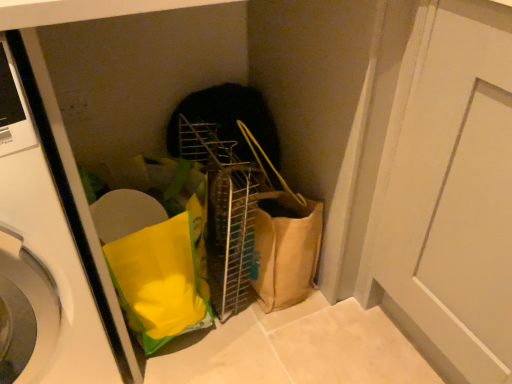
The height and width of the screenshot is (384, 512). What do you see at coordinates (42, 248) in the screenshot? I see `white glossy washing machine at left` at bounding box center [42, 248].

Locate an element on the screen. white glossy washing machine at left is located at coordinates (42, 248).

This screenshot has height=384, width=512. What do you see at coordinates (453, 198) in the screenshot?
I see `white matte door at center-right` at bounding box center [453, 198].

Identify the location of white matte door at center-right. The image size is (512, 384). pos(453,198).

Identify the location of white glossy washing machine at left. (42, 248).

Which object is positioned more to the left, white matte door at center-right or white glossy washing machine at left?

white glossy washing machine at left is more to the left.

Does white matte door at center-right come behind white glossy washing machine at left?

Yes.

Is point (484, 38) behind point (15, 82)?

Yes, it is.

From the image's perspective, would you say white matte door at center-right is shown under white glossy washing machine at left?

Yes.

From a real-world perspective, which is physically above, white matte door at center-right or white glossy washing machine at left?

In real-world perspective, white glossy washing machine at left is above.

Does white matte door at center-right have a lesser width compared to white glossy washing machine at left?

Indeed, white matte door at center-right has a lesser width compared to white glossy washing machine at left.

Between white matte door at center-right and white glossy washing machine at left, which one has less height?

With less height is white matte door at center-right.

Between white matte door at center-right and white glossy washing machine at left, which one has larger size?

Bigger between the two is white glossy washing machine at left.

Does white matte door at center-right contain white glossy washing machine at left?

Actually, white glossy washing machine at left is outside white matte door at center-right.

Is white matte door at center-right not near white glossy washing machine at left?

white matte door at center-right is actually quite close to white glossy washing machine at left.

Is white glossy washing machine at left at the back of white matte door at center-right?

No, white matte door at center-right's orientation is not away from white glossy washing machine at left.

From the picture: How distant is white matte door at center-right from white glossy washing machine at left?

white matte door at center-right and white glossy washing machine at left are 27.28 inches apart from each other.

You are a GUI agent. You are given a task and a screenshot of the screen. Output one action in this format:
    pyautogui.click(x=<x>, y=<y>)
    Task: Click on the door behind the white glossy washing machine at left
    The image size is (512, 384).
    Given the screenshot: What is the action you would take?
    pyautogui.click(x=453, y=198)

In the image, is white glossy washing machine at left on the left side or the right side of white matte door at center-right?

Based on their positions, white glossy washing machine at left is located to the left of white matte door at center-right.

Between white glossy washing machine at left and white matte door at center-right, which one is positioned behind?

white matte door at center-right is more distant.

Which is farther from the camera, (53, 294) or (389, 254)?

Point (389, 254)

From the image's perspective, does white glossy washing machine at left appear higher than white matte door at center-right?

Indeed, from the image's perspective, white glossy washing machine at left is shown above white matte door at center-right.

From a real-world perspective, which is physically below, white glossy washing machine at left or white matte door at center-right?

white matte door at center-right is physically lower.

Considering the sizes of objects white glossy washing machine at left and white matte door at center-right in the image provided, who is thinner, white glossy washing machine at left or white matte door at center-right?

white matte door at center-right is thinner.

Is white glossy washing machine at left taller than white matte door at center-right?

Yes, white glossy washing machine at left is taller than white matte door at center-right.

Between white glossy washing machine at left and white matte door at center-right, which one has smaller size?

white matte door at center-right.

Do you think white glossy washing machine at left is within white matte door at center-right, or outside of it?

white glossy washing machine at left is outside white matte door at center-right.

Are white glossy washing machine at left and white matte door at center-right far apart?

No, white glossy washing machine at left is not far away from white matte door at center-right.

Does white glossy washing machine at left turn towards white matte door at center-right?

No, white glossy washing machine at left is not oriented towards white matte door at center-right.

This screenshot has height=384, width=512. Identify the location of door that is on the right side of white glossy washing machine at left. (453, 198).

There is a white matte door at center-right. Where is `washing machine above it (from a real-world perspective)`? Image resolution: width=512 pixels, height=384 pixels. washing machine above it (from a real-world perspective) is located at coordinates (42, 248).

In order to click on washing machine in front of the white matte door at center-right in this screenshot , I will do `click(42, 248)`.